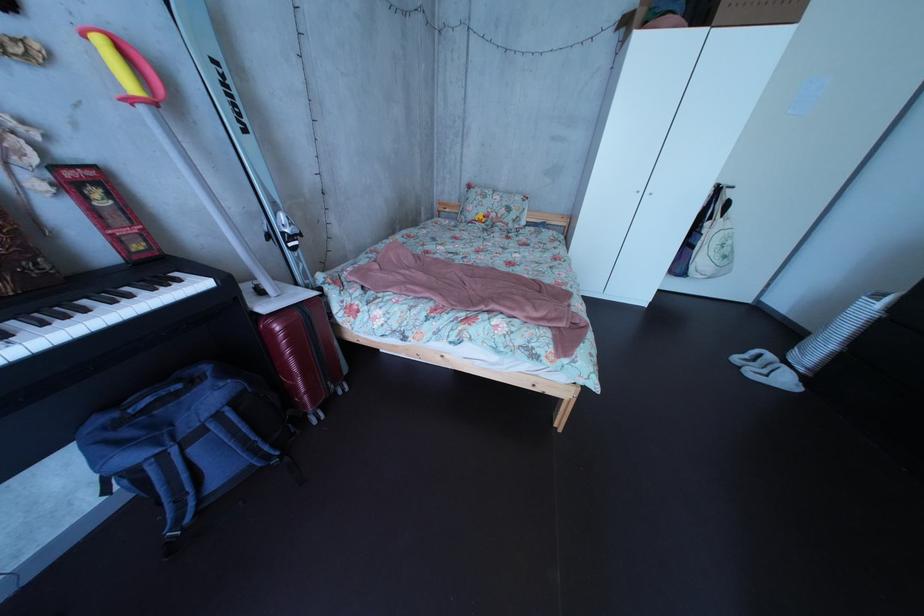
Locate an element on the screen. The height and width of the screenshot is (616, 924). yellow ski pole handle is located at coordinates (127, 68).